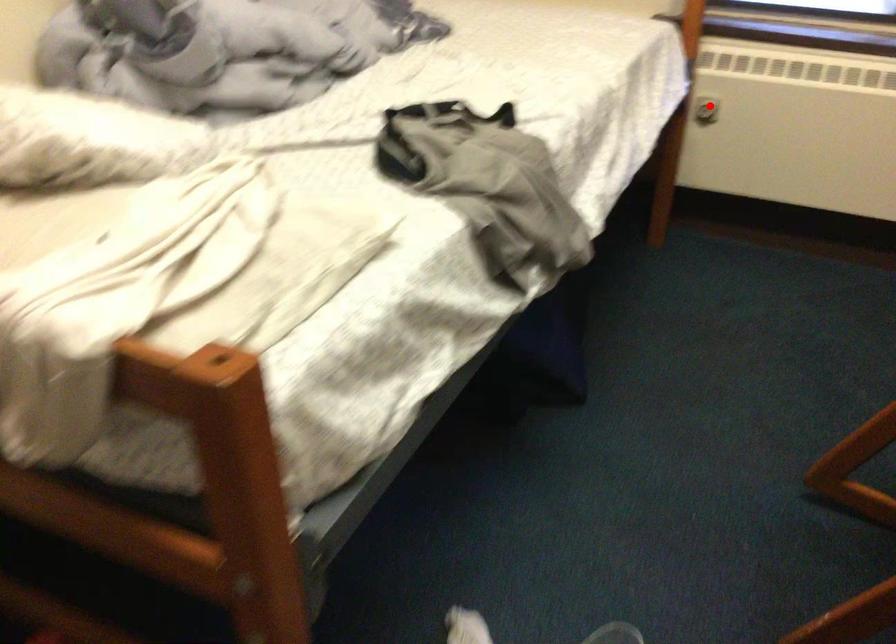
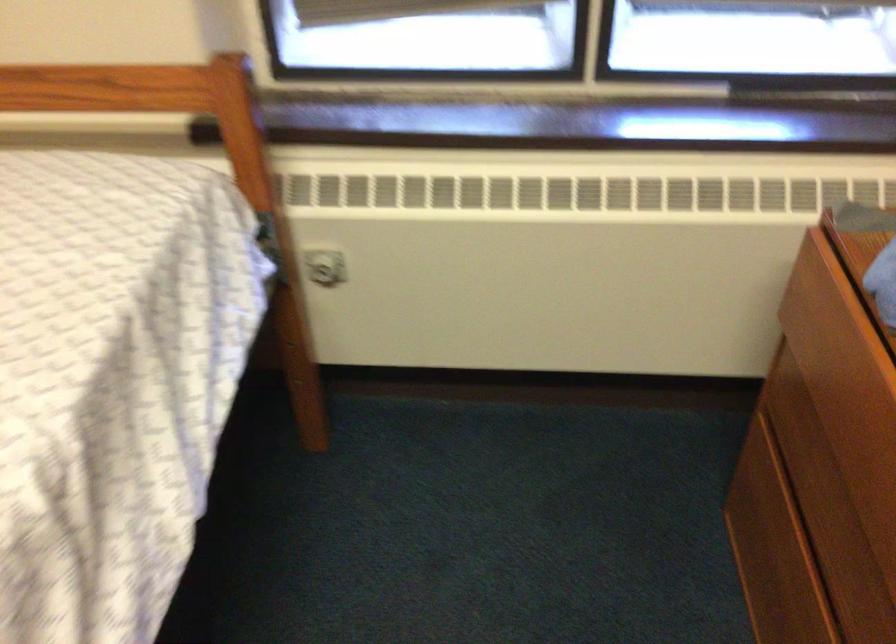
Question: A red point is marked in image1. In image2, is the corresponding 3D point closer to the camera or farther? Reply with the corresponding letter.

Choices:
 (A) The corresponding 3D point is closer.
 (B) The corresponding 3D point is farther.

Answer: (A)